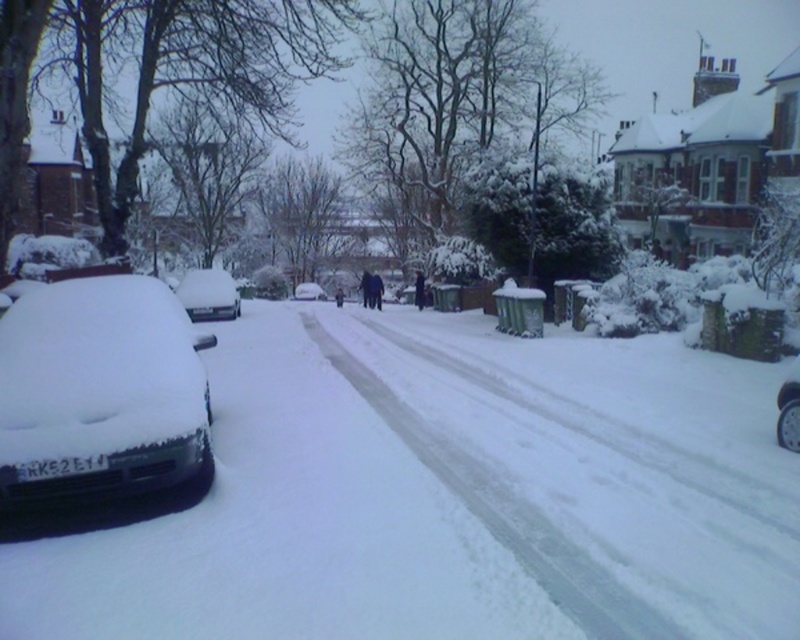
Is sleek silver sedan at left smaller than dark blue fabric at center?

Indeed, sleek silver sedan at left has a smaller size compared to dark blue fabric at center.

Does sleek silver sedan at left appear on the left side of dark blue fabric at center?

Yes, sleek silver sedan at left is to the left of dark blue fabric at center.

I want to click on sleek silver sedan at left, so click(x=208, y=294).

Which is in front, point (325, 298) or point (374, 273)?

Point (325, 298) is more forward.

Which is behind, point (296, 289) or point (380, 285)?

The point (296, 289) is behind.

The image size is (800, 640). In order to click on white matte car at center in this screenshot , I will do `click(308, 291)`.

You are a GUI agent. You are given a task and a screenshot of the screen. Output one action in this format:
    pyautogui.click(x=<x>, y=<y>)
    Task: Click on the white matte car at center
    
    Given the screenshot: What is the action you would take?
    pyautogui.click(x=308, y=291)

Can you confirm if black fabric coat at center is bigger than dark blue fabric at center?

No, black fabric coat at center is not bigger than dark blue fabric at center.

Is black fabric coat at center shorter than dark blue fabric at center?

Correct, black fabric coat at center is not as tall as dark blue fabric at center.

Does point (380, 305) come farther from viewer compared to point (368, 305)?

No, it is not.

Image resolution: width=800 pixels, height=640 pixels. I want to click on black fabric coat at center, so click(x=376, y=291).